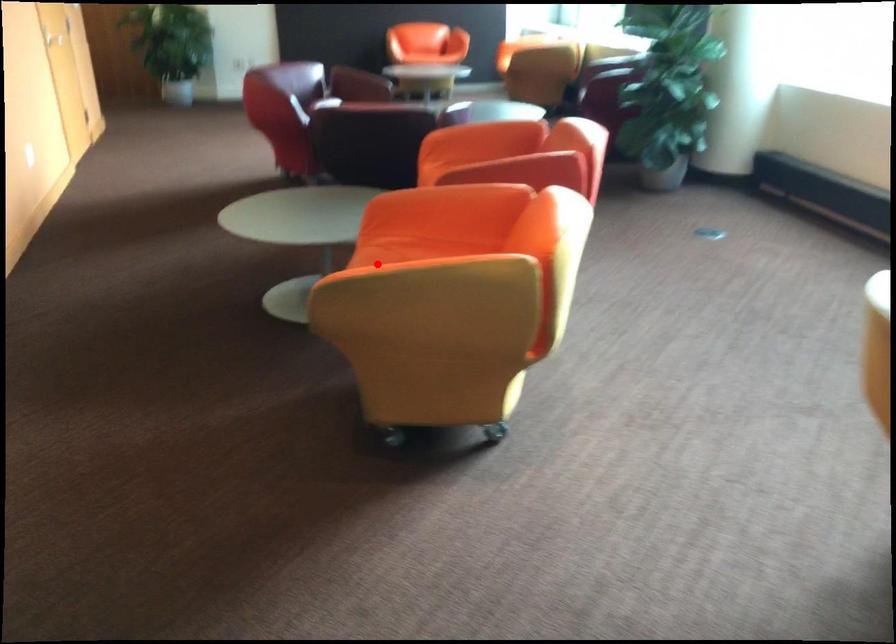
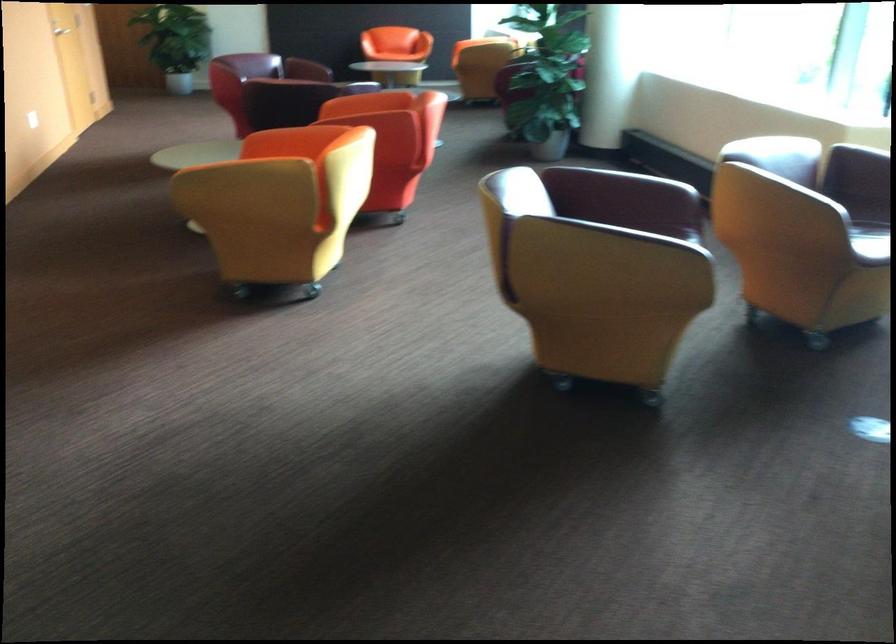
The point at the highlighted location is marked in the first image. Where is the corresponding point in the second image?

(220, 167)